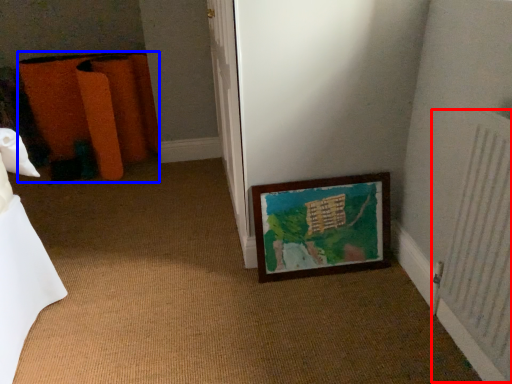
Question: Which object is closer to the camera taking this photo, radiator (highlighted by a red box) or furniture (highlighted by a blue box)?

Choices:
 (A) radiator
 (B) furniture

Answer: (A)